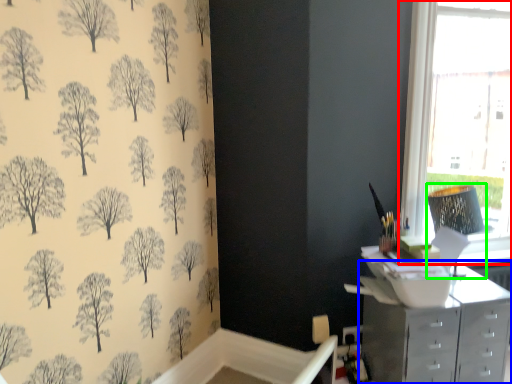
Question: Considering the real-world distances, which object is closest to window (highlighted by a red box)? chest of drawers (highlighted by a blue box) or lamp (highlighted by a green box).

Choices:
 (A) chest of drawers
 (B) lamp

Answer: (B)